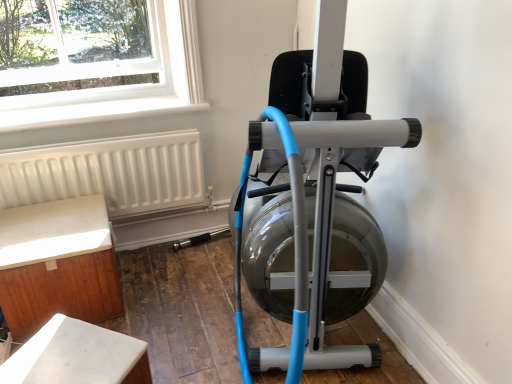
Locate an element on the screen. white wood cabinet at lower left, which is the second furniture from front to back is located at coordinates (57, 264).

Based on the photo, could you tell me if white wood cabinet at lower left, which is counted as the first furniture, starting from the back, is facing white marble table at lower left, which is counted as the second furniture, starting from the back?

Yes, white wood cabinet at lower left, which is counted as the first furniture, starting from the back, is oriented towards white marble table at lower left, which is counted as the second furniture, starting from the back.

In the scene shown: Is white marble table at lower left, arranged as the 1th furniture when viewed from the front, completely or partially inside white wood cabinet at lower left, which is counted as the first furniture, starting from the back?

Definitely not — white marble table at lower left, arranged as the 1th furniture when viewed from the front, is not inside white wood cabinet at lower left, which is counted as the first furniture, starting from the back.

Does white wood cabinet at lower left, which is counted as the first furniture, starting from the back, lie behind white marble table at lower left, which is counted as the second furniture, starting from the back?

That is True.

Does point (33, 279) come behind point (141, 371)?

That is True.

Image resolution: width=512 pixels, height=384 pixels. In order to click on the 1st furniture to the left of the matte silver stationary bicycle at center, counting from the anchor's position in this screenshot , I will do `click(77, 356)`.

Consider the image. From the image's perspective, is matte silver stationary bicycle at center under white marble table at lower left, arranged as the 1th furniture when viewed from the front?

No.

Looking at this image, is white marble table at lower left, arranged as the 1th furniture when viewed from the front, completely or partially inside matte silver stationary bicycle at center?

No, white marble table at lower left, arranged as the 1th furniture when viewed from the front, is not inside matte silver stationary bicycle at center.

Considering the relative sizes of matte silver stationary bicycle at center and white marble table at lower left, arranged as the 1th furniture when viewed from the front, in the image provided, is matte silver stationary bicycle at center wider than white marble table at lower left, arranged as the 1th furniture when viewed from the front,?

Yes.

Between point (332, 355) and point (60, 187), which one is positioned behind?

Positioned behind is point (60, 187).

Is matte silver stationary bicycle at center facing away from white matte radiator at lower left?

No, matte silver stationary bicycle at center is not facing away from white matte radiator at lower left.

From the image's perspective, between matte silver stationary bicycle at center and white matte radiator at lower left, who is located below?

white matte radiator at lower left appears lower in the image.

From a real-world perspective, is white marble table at lower left, arranged as the 1th furniture when viewed from the front, positioned under white wood cabinet at lower left, which is the second furniture from front to back, based on gravity?

Yes, from a real-world perspective, white marble table at lower left, arranged as the 1th furniture when viewed from the front, is beneath white wood cabinet at lower left, which is the second furniture from front to back.

From the image's perspective, is white marble table at lower left, arranged as the 1th furniture when viewed from the front, over white wood cabinet at lower left, which is the second furniture from front to back?

Actually, white marble table at lower left, arranged as the 1th furniture when viewed from the front, appears below white wood cabinet at lower left, which is the second furniture from front to back, in the image.

Is point (37, 340) positioned before point (45, 210)?

That is True.

How many degrees apart are the facing directions of white marble table at lower left, which is counted as the second furniture, starting from the back, and white wood cabinet at lower left, which is counted as the first furniture, starting from the back?

The facing directions of white marble table at lower left, which is counted as the second furniture, starting from the back, and white wood cabinet at lower left, which is counted as the first furniture, starting from the back, are 40.9 degrees apart.

From the image's perspective, is white marble table at lower left, arranged as the 1th furniture when viewed from the front, beneath matte silver stationary bicycle at center?

Yes, from the image's perspective, white marble table at lower left, arranged as the 1th furniture when viewed from the front, is below matte silver stationary bicycle at center.

Can you tell me how much white marble table at lower left, which is counted as the second furniture, starting from the back, and matte silver stationary bicycle at center differ in facing direction?

35.7 degrees separate the facing orientations of white marble table at lower left, which is counted as the second furniture, starting from the back, and matte silver stationary bicycle at center.

Are white marble table at lower left, arranged as the 1th furniture when viewed from the front, and matte silver stationary bicycle at center far apart?

No, white marble table at lower left, arranged as the 1th furniture when viewed from the front, is not far from matte silver stationary bicycle at center.

Is matte silver stationary bicycle at center directly adjacent to white wood cabinet at lower left, which is counted as the first furniture, starting from the back?

No.

Could you tell me if matte silver stationary bicycle at center is turned towards white wood cabinet at lower left, which is the second furniture from front to back?

No, matte silver stationary bicycle at center is not aimed at white wood cabinet at lower left, which is the second furniture from front to back.

Which of these two, matte silver stationary bicycle at center or white wood cabinet at lower left, which is counted as the first furniture, starting from the back, stands shorter?

With less height is white wood cabinet at lower left, which is counted as the first furniture, starting from the back.

Is white matte radiator at lower left further to camera compared to matte silver stationary bicycle at center?

Yes, white matte radiator at lower left is further from the viewer.

How much distance is there between white matte radiator at lower left and matte silver stationary bicycle at center?

A distance of 31.62 inches exists between white matte radiator at lower left and matte silver stationary bicycle at center.

From a real-world perspective, relative to matte silver stationary bicycle at center, is white matte radiator at lower left vertically above or below?

From a real-world perspective, white matte radiator at lower left is physically below matte silver stationary bicycle at center.

Is white matte radiator at lower left aimed at matte silver stationary bicycle at center?

Yes, white matte radiator at lower left is oriented towards matte silver stationary bicycle at center.

Image resolution: width=512 pixels, height=384 pixels. What are the coordinates of `furniture behind the white marble table at lower left, arranged as the 1th furniture when viewed from the front` in the screenshot? It's located at (57, 264).

Where is `stationary bicycle located in front of the white marble table at lower left, arranged as the 1th furniture when viewed from the front`? The height and width of the screenshot is (384, 512). stationary bicycle located in front of the white marble table at lower left, arranged as the 1th furniture when viewed from the front is located at coordinates coord(314,202).

Estimate the real-world distances between objects in this image. Which object is further from matte silver stationary bicycle at center, white marble table at lower left, arranged as the 1th furniture when viewed from the front, or white matte radiator at lower left?

white matte radiator at lower left lies further to matte silver stationary bicycle at center than the other object.

From the image, which object appears to be farther from white marble table at lower left, which is counted as the second furniture, starting from the back, matte silver stationary bicycle at center or white wood cabinet at lower left, which is counted as the first furniture, starting from the back?

matte silver stationary bicycle at center is further to white marble table at lower left, which is counted as the second furniture, starting from the back.

Based on their spatial positions, is white wood cabinet at lower left, which is the second furniture from front to back, or white marble table at lower left, which is counted as the second furniture, starting from the back, further from matte silver stationary bicycle at center?

white wood cabinet at lower left, which is the second furniture from front to back, lies further to matte silver stationary bicycle at center than the other object.

When comparing their distances from white marble table at lower left, which is counted as the second furniture, starting from the back, does white matte radiator at lower left or matte silver stationary bicycle at center seem further?

white matte radiator at lower left lies further to white marble table at lower left, which is counted as the second furniture, starting from the back, than the other object.

Estimate the real-world distances between objects in this image. Which object is closer to white marble table at lower left, which is counted as the second furniture, starting from the back, white wood cabinet at lower left, which is counted as the first furniture, starting from the back, or white matte radiator at lower left?

Among the two, white wood cabinet at lower left, which is counted as the first furniture, starting from the back, is located nearer to white marble table at lower left, which is counted as the second furniture, starting from the back.

Considering their positions, is white matte radiator at lower left positioned further to white wood cabinet at lower left, which is the second furniture from front to back, than matte silver stationary bicycle at center?

matte silver stationary bicycle at center.

When comparing their distances from white matte radiator at lower left, does white wood cabinet at lower left, which is counted as the first furniture, starting from the back, or matte silver stationary bicycle at center seem further?

Based on the image, matte silver stationary bicycle at center appears to be further to white matte radiator at lower left.

When comparing their distances from white marble table at lower left, which is counted as the second furniture, starting from the back, does white matte radiator at lower left or white wood cabinet at lower left, which is counted as the first furniture, starting from the back, seem closer?

white wood cabinet at lower left, which is counted as the first furniture, starting from the back.

In order to click on furniture between white wood cabinet at lower left, which is the second furniture from front to back, and matte silver stationary bicycle at center, in the horizontal direction in this screenshot , I will do `click(77, 356)`.

Find the location of a particular element. furniture that lies between white matte radiator at lower left and white marble table at lower left, arranged as the 1th furniture when viewed from the front, from top to bottom is located at coordinates (57, 264).

The image size is (512, 384). Identify the location of radiator situated between white wood cabinet at lower left, which is counted as the first furniture, starting from the back, and matte silver stationary bicycle at center from left to right. (108, 172).